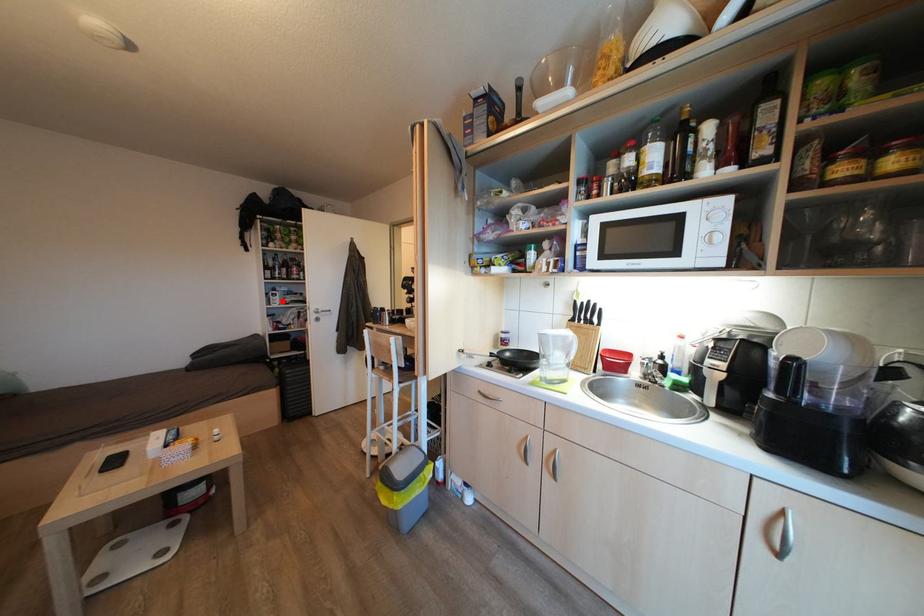
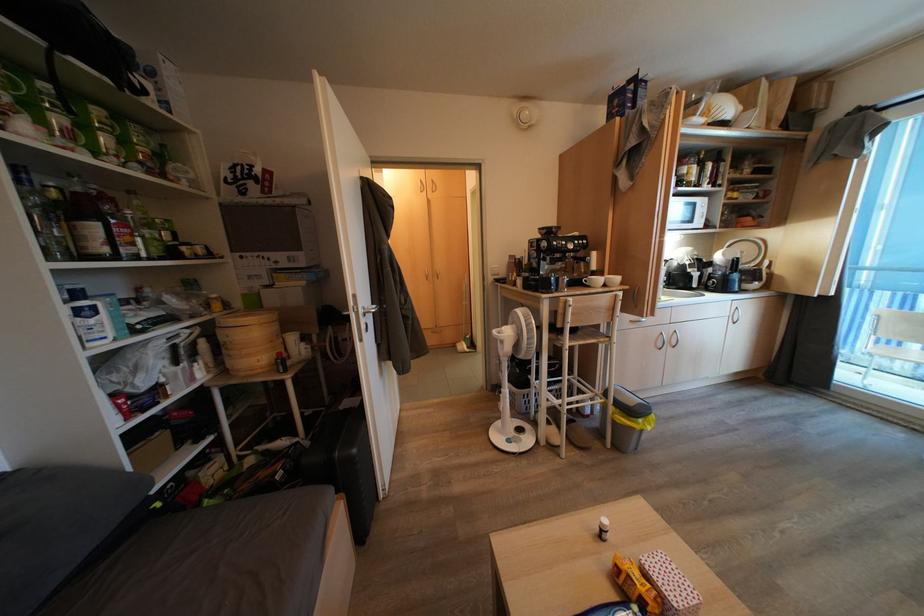
Locate, in the second image, the point that corresponds to the highlighted location in the first image.

(108, 321)